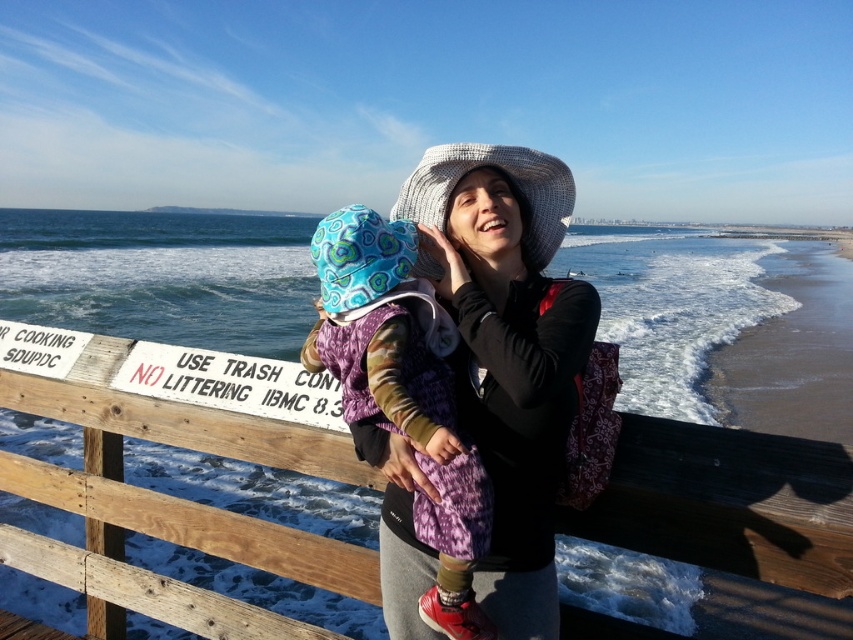
Question: Which object is positioned farthest from the sandy beach at lower right?

Choices:
 (A) wooden at center
 (B) printed fabric baby at center

Answer: (A)

Question: Does wooden at center appear on the right side of sandy beach at lower right?

Choices:
 (A) yes
 (B) no

Answer: (B)

Question: Which point appears closest to the camera in this image?

Choices:
 (A) (389, 512)
 (B) (704, 388)
 (C) (9, 376)

Answer: (A)

Question: Does wooden at center appear over knitted wool hat at center?

Choices:
 (A) no
 (B) yes

Answer: (A)

Question: Which object appears closest to the camera in this image?

Choices:
 (A) sandy beach at lower right
 (B) knitted wool hat at center
 (C) printed fabric baby at center

Answer: (C)

Question: Is wooden at center thinner than sandy beach at lower right?

Choices:
 (A) no
 (B) yes

Answer: (B)